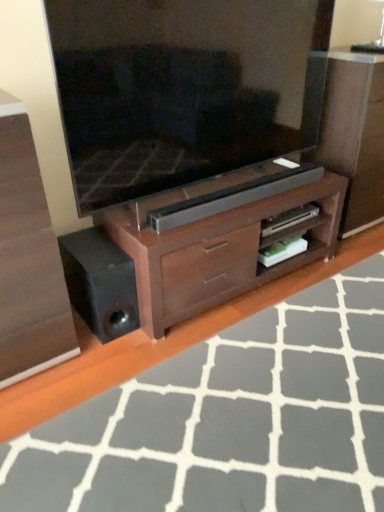
Question: Is wooden floor at lower center at the back of matte wood chest of drawers at center?

Choices:
 (A) no
 (B) yes

Answer: (A)

Question: Can you confirm if matte wood chest of drawers at center is positioned to the right of wooden floor at lower center?

Choices:
 (A) no
 (B) yes

Answer: (A)

Question: From the image's perspective, would you say matte wood chest of drawers at center is shown under wooden floor at lower center?

Choices:
 (A) yes
 (B) no

Answer: (B)

Question: Is matte wood chest of drawers at center taller than wooden floor at lower center?

Choices:
 (A) yes
 (B) no

Answer: (A)

Question: Considering the relative sizes of matte wood chest of drawers at center and wooden floor at lower center in the image provided, is matte wood chest of drawers at center smaller than wooden floor at lower center?

Choices:
 (A) no
 (B) yes

Answer: (A)

Question: From the image's perspective, is matte wood chest of drawers at center above wooden floor at lower center?

Choices:
 (A) no
 (B) yes

Answer: (B)

Question: Considering the relative positions of brown wood tv cabinet at center and wooden floor at lower center in the image provided, is brown wood tv cabinet at center in front of wooden floor at lower center?

Choices:
 (A) no
 (B) yes

Answer: (A)

Question: Is brown wood tv cabinet at center further to the viewer compared to wooden floor at lower center?

Choices:
 (A) no
 (B) yes

Answer: (B)

Question: Are brown wood tv cabinet at center and wooden floor at lower center making contact?

Choices:
 (A) no
 (B) yes

Answer: (A)

Question: Does brown wood tv cabinet at center have a greater width compared to wooden floor at lower center?

Choices:
 (A) no
 (B) yes

Answer: (A)

Question: From the image's perspective, does brown wood tv cabinet at center appear lower than wooden floor at lower center?

Choices:
 (A) no
 (B) yes

Answer: (A)

Question: Does brown wood tv cabinet at center have a lesser height compared to wooden floor at lower center?

Choices:
 (A) no
 (B) yes

Answer: (A)

Question: From a real-world perspective, is wooden dresser at center beneath matte black television at center?

Choices:
 (A) yes
 (B) no

Answer: (A)